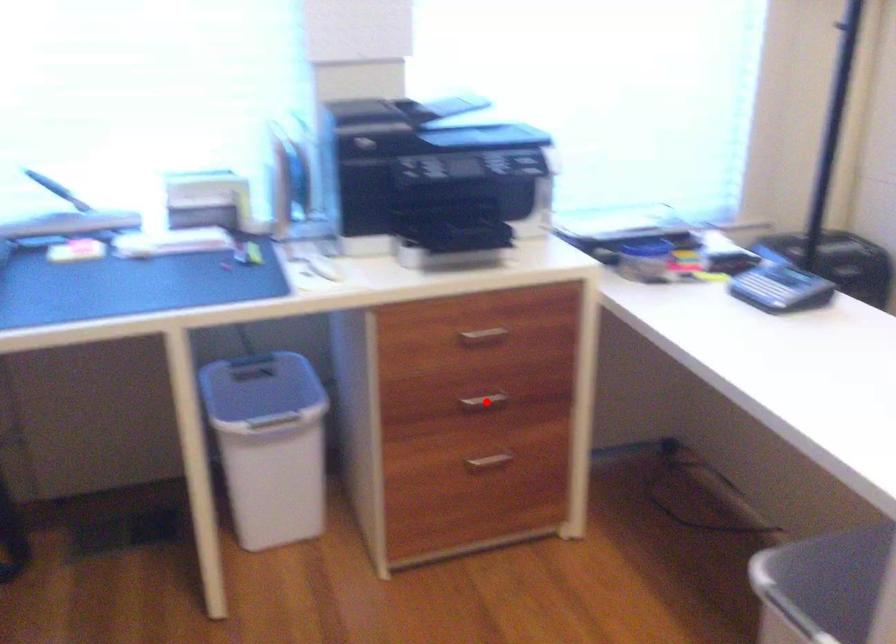
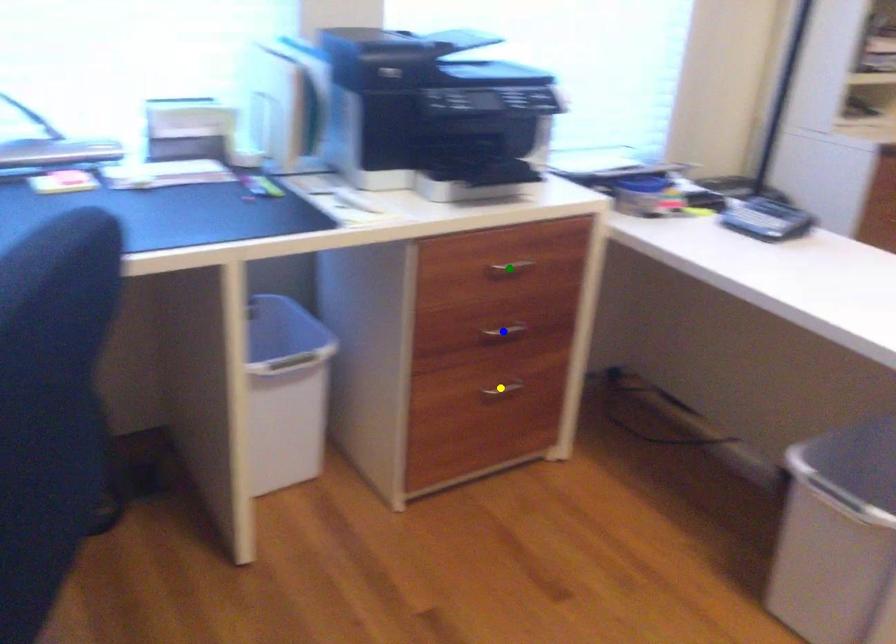
Question: I am providing you with two images of the same scene from different viewpoints. A red point is marked on the first image. You are given multiple points on the second image. Which mark in image 2 goes with the point in image 1?

Choices:
 (A) yellow point
 (B) green point
 (C) blue point

Answer: (C)